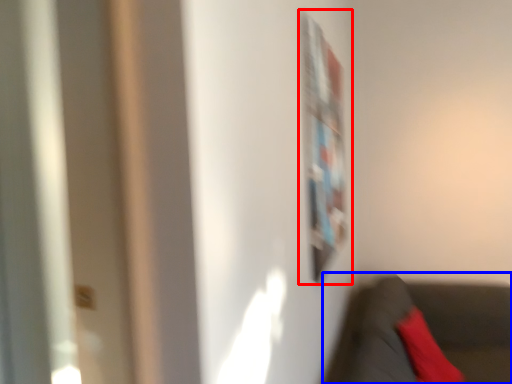
Question: Which point is closer to the camera, bulletin board (highlighted by a red box) or chair (highlighted by a blue box)?

Choices:
 (A) bulletin board
 (B) chair

Answer: (B)